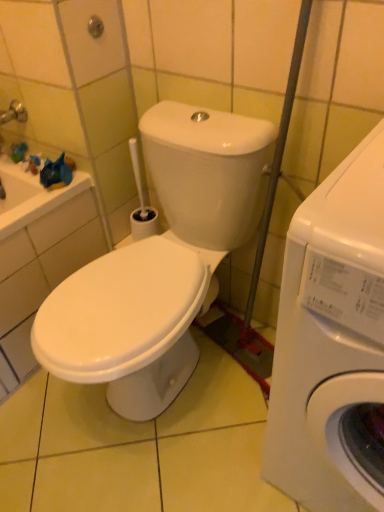
Locate an element on the screen. white glossy washing machine at right, arranged as the second washing machine when viewed from the right is located at coordinates (160, 263).

Find the location of a particular element. green rubber shower at upper left is located at coordinates (95, 27).

How much space does white glossy washing machine at right, which is counted as the 1th washing machine, starting from the right, occupy horizontally?

20.22 inches.

Image resolution: width=384 pixels, height=512 pixels. What do you see at coordinates (332, 342) in the screenshot? I see `white glossy washing machine at right, which is counted as the 1th washing machine, starting from the right` at bounding box center [332, 342].

The width and height of the screenshot is (384, 512). What are the coordinates of `white glossy washing machine at right, arranged as the second washing machine when viewed from the right` in the screenshot? It's located at (160, 263).

Is green rubber shower at upper left shorter than white glossy washing machine at right, arranged as the second washing machine when viewed from the right?

Yes.

From the image's perspective, between green rubber shower at upper left and white glossy washing machine at right, positioned as the 1th washing machine in left-to-right order, who is located below?

white glossy washing machine at right, positioned as the 1th washing machine in left-to-right order.

Is green rubber shower at upper left next to white glossy washing machine at right, arranged as the second washing machine when viewed from the right, and touching it?

There is a gap between green rubber shower at upper left and white glossy washing machine at right, arranged as the second washing machine when viewed from the right.

Locate an element on the screen. This screenshot has width=384, height=512. washing machine that appears above the white glossy washing machine at right, arranged as the second washing machine when viewed from the right (from a real-world perspective) is located at coordinates (332, 342).

Can we say white glossy washing machine at right, arranged as the second washing machine when viewed from the right, lies outside white glossy washing machine at right, which is counted as the 1th washing machine, starting from the right?

Indeed, white glossy washing machine at right, arranged as the second washing machine when viewed from the right, is completely outside white glossy washing machine at right, which is counted as the 1th washing machine, starting from the right.

Could you tell me if white glossy washing machine at right, positioned as the 1th washing machine in left-to-right order, is facing white glossy washing machine at right, which is counted as the 1th washing machine, starting from the right?

No, white glossy washing machine at right, positioned as the 1th washing machine in left-to-right order, is not aimed at white glossy washing machine at right, which is counted as the 1th washing machine, starting from the right.

Which object is closer to the camera taking this photo, white glossy washing machine at right, positioned as the 1th washing machine in left-to-right order, or white glossy washing machine at right, which is counted as the 1th washing machine, starting from the right?

white glossy washing machine at right, which is counted as the 1th washing machine, starting from the right, is more forward.

Can you tell me how much green rubber shower at upper left and white glossy washing machine at right, which ranks as the second washing machine in left-to-right order, differ in facing direction?

There is a 88.6-degree angle between the facing directions of green rubber shower at upper left and white glossy washing machine at right, which ranks as the second washing machine in left-to-right order.

Is white glossy washing machine at right, which is counted as the 1th washing machine, starting from the right, a part of green rubber shower at upper left?

No, white glossy washing machine at right, which is counted as the 1th washing machine, starting from the right, is not inside green rubber shower at upper left.

In the image, is green rubber shower at upper left positioned in front of or behind white glossy washing machine at right, which is counted as the 1th washing machine, starting from the right?

In the image, green rubber shower at upper left appears behind white glossy washing machine at right, which is counted as the 1th washing machine, starting from the right.

Can you confirm if green rubber shower at upper left is positioned to the right of white glossy washing machine at right, which ranks as the second washing machine in left-to-right order?

Incorrect, green rubber shower at upper left is not on the right side of white glossy washing machine at right, which ranks as the second washing machine in left-to-right order.

Is white glossy washing machine at right, arranged as the second washing machine when viewed from the right, placed right next to green rubber shower at upper left?

No, white glossy washing machine at right, arranged as the second washing machine when viewed from the right, is not in contact with green rubber shower at upper left.

How different are the orientations of white glossy washing machine at right, positioned as the 1th washing machine in left-to-right order, and green rubber shower at upper left in degrees?

white glossy washing machine at right, positioned as the 1th washing machine in left-to-right order, and green rubber shower at upper left are facing 86.7 degrees away from each other.

Is white glossy washing machine at right, arranged as the second washing machine when viewed from the right, aimed at green rubber shower at upper left?

No, white glossy washing machine at right, arranged as the second washing machine when viewed from the right, is not turned towards green rubber shower at upper left.

Find the location of a particular element. washing machine that is the 2nd one below the green rubber shower at upper left (from a real-world perspective) is located at coordinates (160, 263).

Is white glossy washing machine at right, arranged as the second washing machine when viewed from the right, surrounded by white glossy washing machine at right, which is counted as the 1th washing machine, starting from the right?

That's incorrect, white glossy washing machine at right, arranged as the second washing machine when viewed from the right, is not inside white glossy washing machine at right, which is counted as the 1th washing machine, starting from the right.

From the image's perspective, which is above, white glossy washing machine at right, which ranks as the second washing machine in left-to-right order, or white glossy washing machine at right, arranged as the second washing machine when viewed from the right?

white glossy washing machine at right, arranged as the second washing machine when viewed from the right, from the image's perspective.

Is point (370, 157) behind point (143, 252)?

No, (370, 157) is in front of (143, 252).

Locate an element on the screen. washing machine above the white glossy washing machine at right, positioned as the 1th washing machine in left-to-right order (from a real-world perspective) is located at coordinates click(x=332, y=342).

Does white glossy washing machine at right, which is counted as the 1th washing machine, starting from the right, have a lesser width compared to green rubber shower at upper left?

In fact, white glossy washing machine at right, which is counted as the 1th washing machine, starting from the right, might be wider than green rubber shower at upper left.

Where is `shower that appears above the white glossy washing machine at right, which ranks as the second washing machine in left-to-right order (from the image's perspective)`? The image size is (384, 512). shower that appears above the white glossy washing machine at right, which ranks as the second washing machine in left-to-right order (from the image's perspective) is located at coordinates (95, 27).

Considering the relative positions of white glossy washing machine at right, which is counted as the 1th washing machine, starting from the right, and green rubber shower at upper left in the image provided, is white glossy washing machine at right, which is counted as the 1th washing machine, starting from the right, to the left of green rubber shower at upper left from the viewer's perspective?

No.

From a real-world perspective, count 2nd washing machines downward from the green rubber shower at upper left and point to it. Please provide its 2D coordinates.

[(160, 263)]

Find the location of a particular element. This screenshot has width=384, height=512. washing machine above the white glossy washing machine at right, arranged as the second washing machine when viewed from the right (from a real-world perspective) is located at coordinates (332, 342).

When comparing their distances from white glossy washing machine at right, which is counted as the 1th washing machine, starting from the right, does white glossy washing machine at right, positioned as the 1th washing machine in left-to-right order, or green rubber shower at upper left seem closer?

white glossy washing machine at right, positioned as the 1th washing machine in left-to-right order, is positioned closer to the anchor white glossy washing machine at right, which is counted as the 1th washing machine, starting from the right.

Estimate the real-world distances between objects in this image. Which object is further from white glossy washing machine at right, positioned as the 1th washing machine in left-to-right order, green rubber shower at upper left or white glossy washing machine at right, which is counted as the 1th washing machine, starting from the right?

green rubber shower at upper left lies further to white glossy washing machine at right, positioned as the 1th washing machine in left-to-right order, than the other object.

Estimate the real-world distances between objects in this image. Which object is closer to green rubber shower at upper left, white glossy washing machine at right, which ranks as the second washing machine in left-to-right order, or white glossy washing machine at right, positioned as the 1th washing machine in left-to-right order?

white glossy washing machine at right, positioned as the 1th washing machine in left-to-right order, is closer to green rubber shower at upper left.

Looking at the image, which one is located closer to white glossy washing machine at right, arranged as the second washing machine when viewed from the right, white glossy washing machine at right, which is counted as the 1th washing machine, starting from the right, or green rubber shower at upper left?

white glossy washing machine at right, which is counted as the 1th washing machine, starting from the right, is closer to white glossy washing machine at right, arranged as the second washing machine when viewed from the right.

Estimate the real-world distances between objects in this image. Which object is further from white glossy washing machine at right, which is counted as the 1th washing machine, starting from the right, green rubber shower at upper left or white glossy washing machine at right, arranged as the second washing machine when viewed from the right?

green rubber shower at upper left lies further to white glossy washing machine at right, which is counted as the 1th washing machine, starting from the right, than the other object.

Which object lies nearer to the anchor point green rubber shower at upper left, white glossy washing machine at right, arranged as the second washing machine when viewed from the right, or white glossy washing machine at right, which is counted as the 1th washing machine, starting from the right?

The object closer to green rubber shower at upper left is white glossy washing machine at right, arranged as the second washing machine when viewed from the right.

Where is `washing machine between green rubber shower at upper left and white glossy washing machine at right, which is counted as the 1th washing machine, starting from the right, in the vertical direction`? The width and height of the screenshot is (384, 512). washing machine between green rubber shower at upper left and white glossy washing machine at right, which is counted as the 1th washing machine, starting from the right, in the vertical direction is located at coordinates [x=160, y=263].